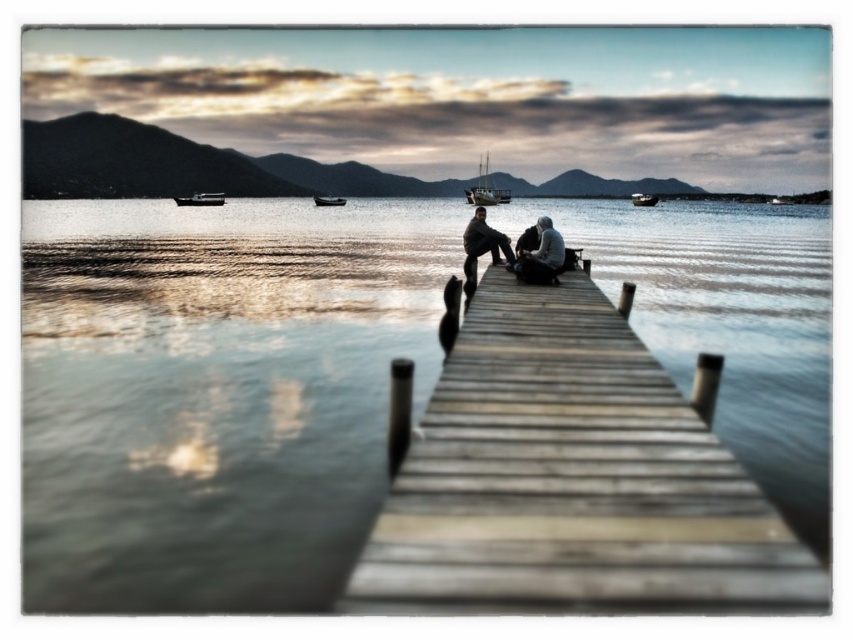
Question: Which point is farther to the camera?

Choices:
 (A) 213,204
 (B) 637,193

Answer: (B)

Question: Is wooden dock at center positioned in front of metallic silver boat at center?

Choices:
 (A) no
 (B) yes

Answer: (B)

Question: Which point appears closest to the camera in this image?

Choices:
 (A) (648, 204)
 (B) (505, 189)
 (C) (321, 202)
 (D) (494, 228)

Answer: (D)

Question: Does matte gray clothing at center lie in front of wooden sailboat at center?

Choices:
 (A) yes
 (B) no

Answer: (A)

Question: Can you confirm if metallic gray boat at lower left is wider than metallic silver boat at center?

Choices:
 (A) no
 (B) yes

Answer: (B)

Question: Considering the real-world distances, which object is farthest from the metallic silver boat at center?

Choices:
 (A) wooden dock at center
 (B) smooth gray sweater at center

Answer: (A)